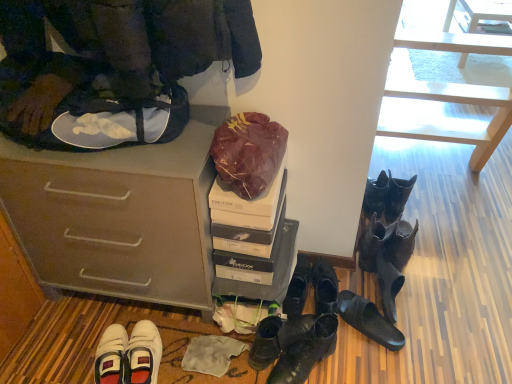
Question: Is leather boots at center, acting as the eighth footwear starting from the right, facing towards shiny black boots at center, the 7th footwear viewed from the right?

Choices:
 (A) yes
 (B) no

Answer: (A)

Question: From the image's perspective, is leather boots at center, acting as the eighth footwear starting from the right, on shiny black boots at center, the 7th footwear viewed from the right?

Choices:
 (A) no
 (B) yes

Answer: (B)

Question: Is leather boots at center, acting as the eighth footwear starting from the right, at the right side of shiny black boots at center, placed as the 2th footwear when sorted from left to right?

Choices:
 (A) no
 (B) yes

Answer: (A)

Question: Is shiny black boots at center, the 7th footwear viewed from the right, a part of leather boots at center, acting as the eighth footwear starting from the right?

Choices:
 (A) no
 (B) yes

Answer: (B)

Question: Does leather boots at center, acting as the eighth footwear starting from the right, have a greater width compared to shiny black boots at center, placed as the 2th footwear when sorted from left to right?

Choices:
 (A) yes
 (B) no

Answer: (B)

Question: Is shiny black boots at center, placed as the 2th footwear when sorted from left to right, at the back of leather boots at center, acting as the eighth footwear starting from the right?

Choices:
 (A) yes
 (B) no

Answer: (B)

Question: Is black leather boots at lower right, arranged as the 3th footwear when viewed from the right, closer to camera compared to black rubber sandals at lower center, arranged as the 5th footwear when viewed from the left?

Choices:
 (A) no
 (B) yes

Answer: (A)

Question: Is black leather boots at lower right, arranged as the 3th footwear when viewed from the right, next to black rubber sandals at lower center, arranged as the 5th footwear when viewed from the left, and touching it?

Choices:
 (A) no
 (B) yes

Answer: (A)

Question: From the image's perspective, is black leather boots at lower right, arranged as the 3th footwear when viewed from the right, on top of black rubber sandals at lower center, the fourth footwear from the right?

Choices:
 (A) yes
 (B) no

Answer: (A)

Question: Can you confirm if black leather boots at lower right, the 6th footwear from the left, is positioned to the right of black rubber sandals at lower center, the fourth footwear from the right?

Choices:
 (A) no
 (B) yes

Answer: (B)

Question: Does black leather boots at lower right, the 6th footwear from the left, have a greater width compared to black rubber sandals at lower center, the fourth footwear from the right?

Choices:
 (A) no
 (B) yes

Answer: (B)

Question: Considering the relative sizes of black leather boots at lower right, arranged as the 3th footwear when viewed from the right, and black rubber sandals at lower center, arranged as the 5th footwear when viewed from the left, in the image provided, is black leather boots at lower right, arranged as the 3th footwear when viewed from the right, shorter than black rubber sandals at lower center, arranged as the 5th footwear when viewed from the left,?

Choices:
 (A) no
 (B) yes

Answer: (A)

Question: From a real-world perspective, does black leather boots at lower right, arranged as the 3th footwear when viewed from the right, stand above leather boots at center, acting as the eighth footwear starting from the right?

Choices:
 (A) yes
 (B) no

Answer: (A)